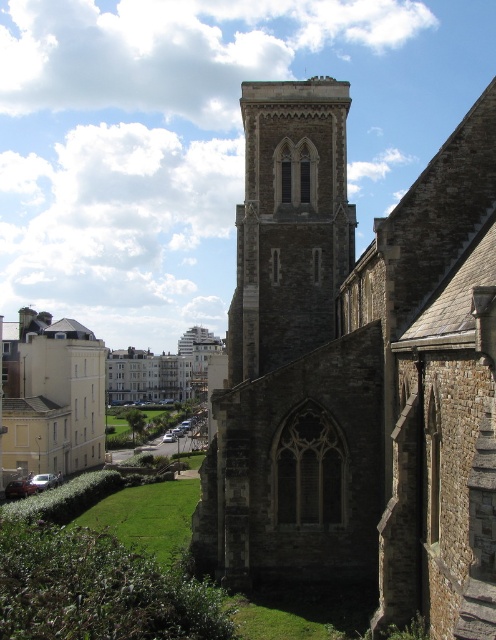
Can you confirm if stone gothic tower at center is shorter than white stone building at left?

No, stone gothic tower at center is not shorter than white stone building at left.

Who is lower down, stone gothic tower at center or white stone building at left?

white stone building at left is lower down.

Does point (312, 321) lie in front of point (85, 355)?

Yes, it is in front of point (85, 355).

At what (x,y) coordinates should I click in order to perform the action: click on stone gothic tower at center. Please return your answer as a coordinate pair (x, y). The image size is (496, 640). Looking at the image, I should click on (290, 224).

Is brown stone church at center positioned at the back of stone gothic tower at center?

A: That is False.

Does brown stone church at center have a greater width compared to stone gothic tower at center?

Yes, brown stone church at center is wider than stone gothic tower at center.

Where is `brown stone church at center`? This screenshot has height=640, width=496. brown stone church at center is located at coordinates coord(359,372).

Who is positioned more to the right, brown stone church at center or white stone building at left?

From the viewer's perspective, brown stone church at center appears more on the right side.

Which is in front, point (444, 154) or point (103, 406)?

Point (444, 154) is in front.

Does point (260, 160) come closer to viewer compared to point (81, 397)?

That is True.

The width and height of the screenshot is (496, 640). What are the coordinates of `brown stone church at center` in the screenshot? It's located at (359, 372).